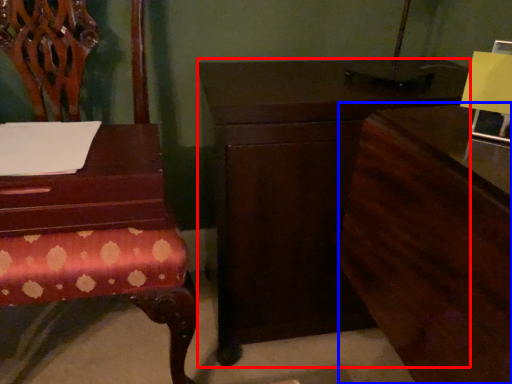
Question: Which point is closer to the camera, nightstand (highlighted by a red box) or dresser (highlighted by a blue box)?

Choices:
 (A) nightstand
 (B) dresser

Answer: (B)